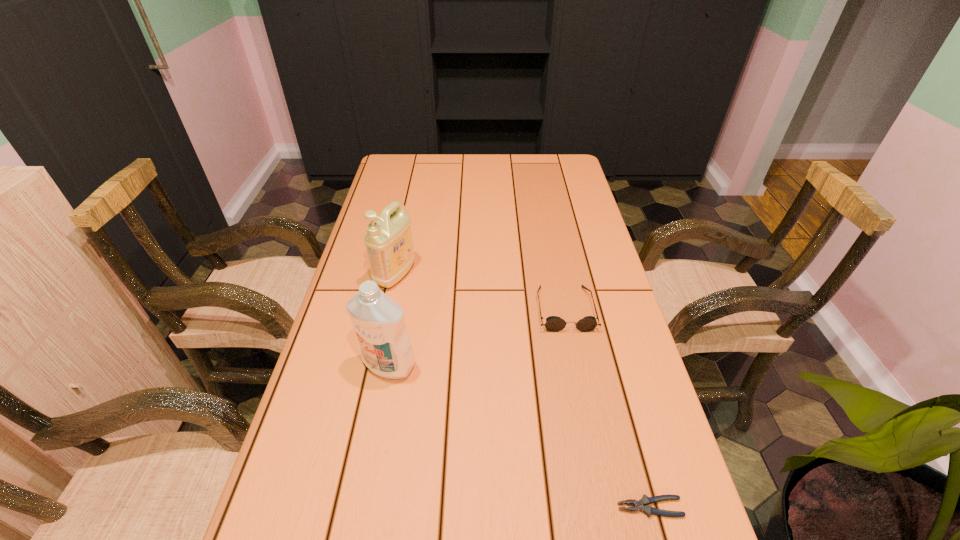
What are the coordinates of `vacant space located 0.310m at the gripping part of the pliers` in the screenshot? It's located at (445, 507).

In order to click on sunglasses that is at the right edge in this screenshot , I will do `click(553, 323)`.

Where is `pliers situated at the right edge`? The image size is (960, 540). pliers situated at the right edge is located at coordinates (641, 505).

Image resolution: width=960 pixels, height=540 pixels. Identify the location of blank space at the far edge. (432, 157).

At what (x,y) coordinates should I click in order to perform the action: click on blank space at the left edge. Please return your answer as a coordinate pair (x, y). The height and width of the screenshot is (540, 960). Looking at the image, I should click on (355, 384).

The width and height of the screenshot is (960, 540). In order to click on vacant space at the right edge of the desktop in this screenshot , I will do `click(583, 226)`.

In order to click on vacant region at the far left corner of the desktop in this screenshot , I will do `click(412, 158)`.

In the image, there is a desktop. Where is `vacant region at the far right corner`? Image resolution: width=960 pixels, height=540 pixels. vacant region at the far right corner is located at coordinates (578, 173).

This screenshot has width=960, height=540. In order to click on free space between the farther detergent and the nearest object in this screenshot , I will do `click(522, 391)`.

The height and width of the screenshot is (540, 960). I want to click on free space between the third farthest object and the shortest object, so click(x=519, y=436).